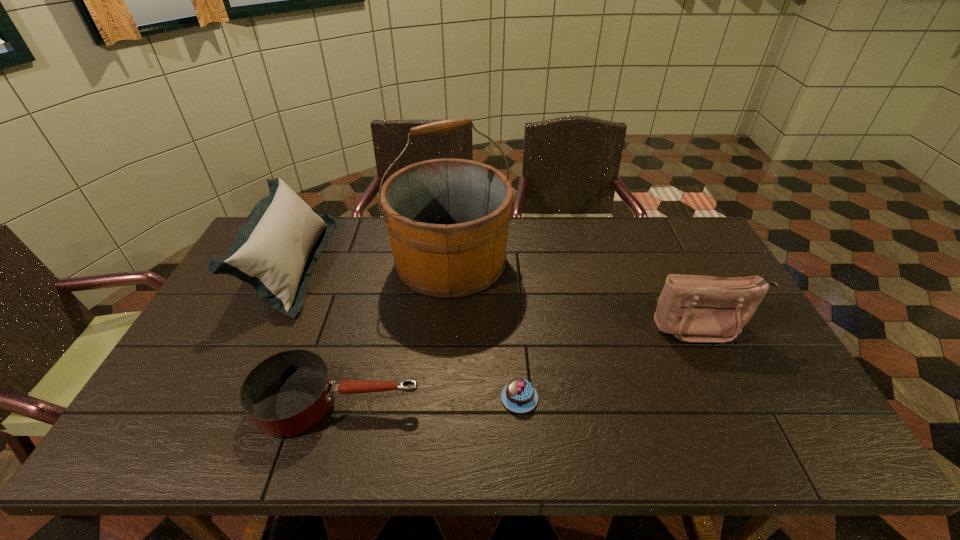
I want to click on free area in between the cushion and the rightmost object, so click(x=496, y=295).

The height and width of the screenshot is (540, 960). Find the location of `object that stands as the closest to the pan`. object that stands as the closest to the pan is located at coordinates (276, 248).

This screenshot has width=960, height=540. In order to click on object that stands as the closest to the fourth tallest object in this screenshot , I will do `click(276, 248)`.

Locate an element on the screen. This screenshot has height=540, width=960. vacant space that satisfies the following two spatial constraints: 1. on the front pocket of the rightmost object; 2. on the handle side of the pan is located at coordinates (740, 402).

At what (x,y) coordinates should I click in order to perform the action: click on free space that satisfies the following two spatial constraints: 1. on the front side of the shortest object; 2. on the handle side of the pan. Please return your answer as a coordinate pair (x, y). This screenshot has height=540, width=960. Looking at the image, I should click on pyautogui.click(x=520, y=402).

Locate an element on the screen. The image size is (960, 540). free space that satisfies the following two spatial constraints: 1. on the front side of the chocolate cake; 2. on the handle side of the fourth tallest object is located at coordinates (520, 402).